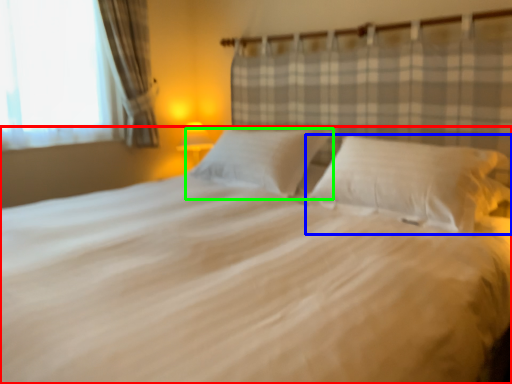
Question: Which object is the farthest from bed (highlighted by a red box)? Choose among these: pillow (highlighted by a blue box) or pillow (highlighted by a green box).

Choices:
 (A) pillow
 (B) pillow

Answer: (B)